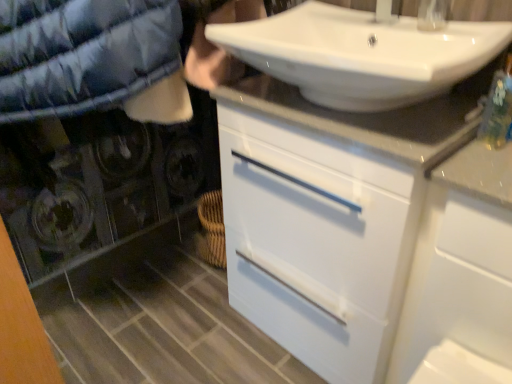
Question: Is white glossy faucet at upper center to the left or to the right of white glossy sink at upper center in the image?

Choices:
 (A) right
 (B) left

Answer: (A)

Question: From the image's perspective, is white glossy faucet at upper center above or below white glossy sink at upper center?

Choices:
 (A) above
 (B) below

Answer: (A)

Question: Which object is the closest to the white glossy cabinet at upper right?

Choices:
 (A) white glossy cabinet at center
 (B) white glossy faucet at upper center
 (C) white glossy sink at upper center

Answer: (A)

Question: Considering the real-world distances, which object is closest to the white glossy cabinet at center?

Choices:
 (A) white glossy cabinet at upper right
 (B) white glossy sink at upper center
 (C) white glossy faucet at upper center

Answer: (A)